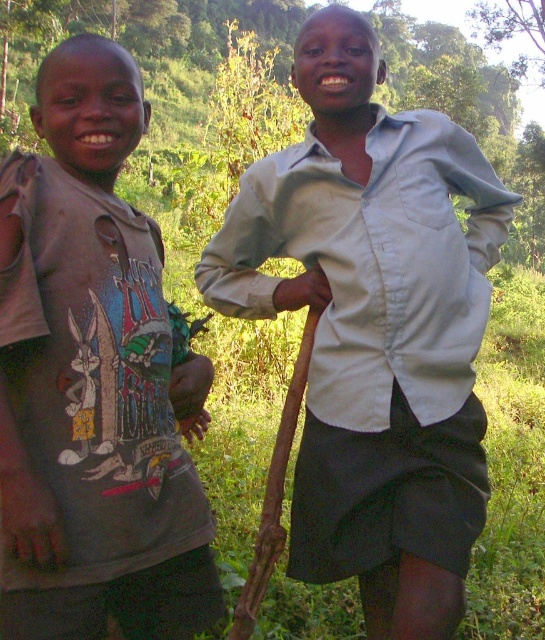
Question: Which point is closer to the camera?

Choices:
 (A) light blue cotton shirt at center
 (B) matte gray t-shirt at left

Answer: (B)

Question: From the image, what is the correct spatial relationship of light blue cotton shirt at center in relation to matte gray t-shirt at left?

Choices:
 (A) right
 (B) left

Answer: (A)

Question: Which point is farther to the camera?

Choices:
 (A) matte gray t-shirt at left
 (B) light blue cotton shirt at center

Answer: (B)

Question: Is light blue cotton shirt at center below matte gray t-shirt at left?

Choices:
 (A) yes
 (B) no

Answer: (A)

Question: Can you confirm if light blue cotton shirt at center is positioned to the left of matte gray t-shirt at left?

Choices:
 (A) yes
 (B) no

Answer: (B)